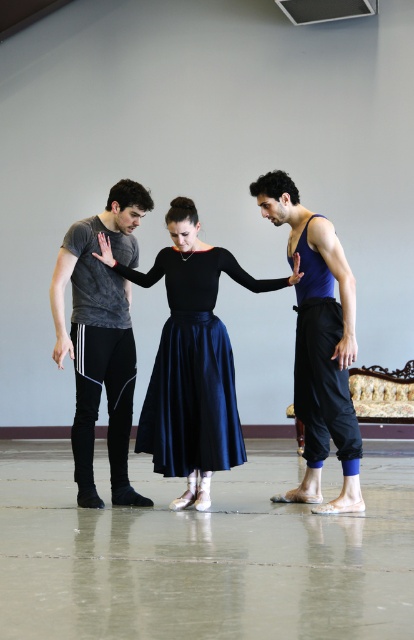
Based on the scene description, which object is positioned lower on the central figure? The satin skirt at center or the blue fabric tank top at center?

The satin skirt at center is located below the blue fabric tank top at center, so the satin skirt at center is positioned lower on the central figure.